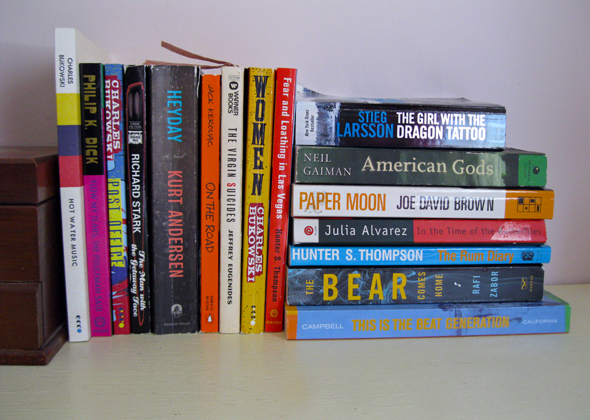
Where is `book stored vertically`? book stored vertically is located at coordinates (65, 161), (90, 165), (114, 168), (130, 168), (162, 173), (213, 175), (230, 175), (254, 171), (277, 181).